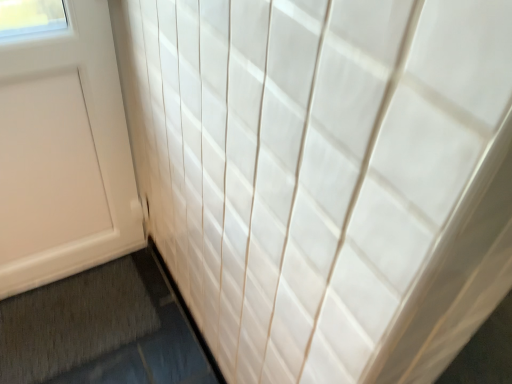
The height and width of the screenshot is (384, 512). Find the location of `gray textured bath mat at lower left`. gray textured bath mat at lower left is located at coordinates (75, 320).

Describe the element at coordinates (75, 320) in the screenshot. The width and height of the screenshot is (512, 384). I see `gray textured bath mat at lower left` at that location.

This screenshot has height=384, width=512. Describe the element at coordinates (64, 153) in the screenshot. I see `white matte door at left` at that location.

The height and width of the screenshot is (384, 512). Find the location of `white matte door at left`. white matte door at left is located at coordinates (64, 153).

Identify the location of gray textured bath mat at lower left. The height and width of the screenshot is (384, 512). (75, 320).

Which object is positioned more to the right, gray textured bath mat at lower left or white matte door at left?

gray textured bath mat at lower left.

Between gray textured bath mat at lower left and white matte door at left, which one is positioned behind?

gray textured bath mat at lower left is further from the camera.

In the scene shown: Which point is more forward, (101, 304) or (17, 290)?

The point (101, 304) is more forward.

From the image's perspective, is gray textured bath mat at lower left below white matte door at left?

Yes, from the image's perspective, gray textured bath mat at lower left is below white matte door at left.

From a real-world perspective, is gray textured bath mat at lower left under white matte door at left?

Yes.

Does gray textured bath mat at lower left have a greater width compared to white matte door at left?

Yes.

Considering the sizes of gray textured bath mat at lower left and white matte door at left in the image, is gray textured bath mat at lower left taller or shorter than white matte door at left?

In the image, gray textured bath mat at lower left appears to be shorter than white matte door at left.

Can you confirm if gray textured bath mat at lower left is bigger than white matte door at left?

No.

Would you say gray textured bath mat at lower left is outside white matte door at left?

Yes, gray textured bath mat at lower left is not within white matte door at left.

Would you say gray textured bath mat at lower left is a long distance from white matte door at left?

Actually, gray textured bath mat at lower left and white matte door at left are a little close together.

Is gray textured bath mat at lower left facing towards white matte door at left?

No, gray textured bath mat at lower left does not turn towards white matte door at left.

The image size is (512, 384). Identify the location of door on the left of the gray textured bath mat at lower left. (64, 153).

Between white matte door at left and gray textured bath mat at lower left, which one appears on the right side from the viewer's perspective?

Positioned to the right is gray textured bath mat at lower left.

Considering their positions, is white matte door at left located in front of or behind gray textured bath mat at lower left?

Visually, white matte door at left is located in front of gray textured bath mat at lower left.

Considering the positions of point (2, 145) and point (155, 308), is point (2, 145) closer or farther from the camera than point (155, 308)?

Point (2, 145).

From the image's perspective, which is above, white matte door at left or gray textured bath mat at lower left?

white matte door at left is shown above in the image.

From a real-world perspective, which is physically above, white matte door at left or gray textured bath mat at lower left?

In real-world perspective, white matte door at left is above.

Looking at their sizes, would you say white matte door at left is wider or thinner than gray textured bath mat at lower left?

Considering their sizes, white matte door at left looks slimmer than gray textured bath mat at lower left.

Is white matte door at left taller or shorter than gray textured bath mat at lower left?

Clearly, white matte door at left is taller compared to gray textured bath mat at lower left.

Is white matte door at left bigger or smaller than gray textured bath mat at lower left?

Considering their sizes, white matte door at left takes up more space than gray textured bath mat at lower left.

Is gray textured bath mat at lower left located within white matte door at left?

Definitely not — gray textured bath mat at lower left is not inside white matte door at left.

Is there a large distance between white matte door at left and gray textured bath mat at lower left?

They are positioned close to each other.

Is white matte door at left facing towards gray textured bath mat at lower left?

Yes.

What are the coordinates of `bath mat that is behind the white matte door at left` in the screenshot? It's located at (75, 320).

Locate an element on the screen. This screenshot has width=512, height=384. door above the gray textured bath mat at lower left (from a real-world perspective) is located at coordinates (64, 153).

Find the location of a particular element. bath mat located on the right of white matte door at left is located at coordinates (75, 320).